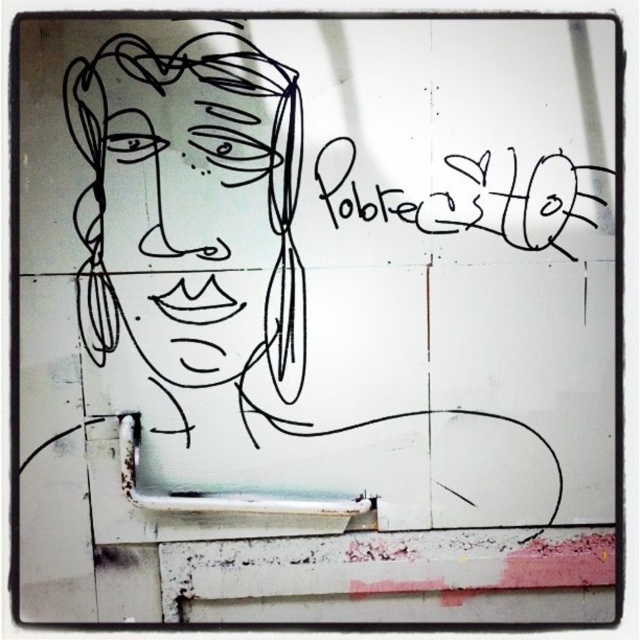
You are an art student analyzing the street art. You notice the black line drawing face at upper left and the black marker writing at upper right. Which object takes up more space in the image?

The black line drawing face at upper left is bigger than the black marker writing at upper right, so it takes up more space in the image.

You are standing in front of the street art and want to take a photo of the black line drawing face at upper left. If your camera can focus on objects up to 2 meters away, will it be able to capture the face clearly?

The black line drawing face at upper left is 2.19 meters away from the viewer, which is beyond the camera focus range of 2 meters. Therefore, the camera may not capture the face clearly.

You are an art student analyzing the street art. The coordinates point to an object in the scene. What object is located at point (189,166)?

The point (189,166) indicates the black line drawing face at upper left.